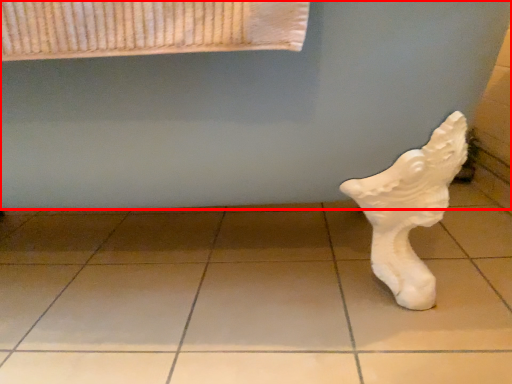
Question: From the image's perspective, considering the relative positions of bath (annotated by the red box) and tile in the image provided, where is bath (annotated by the red box) located with respect to the staircase?

Choices:
 (A) below
 (B) above

Answer: (B)